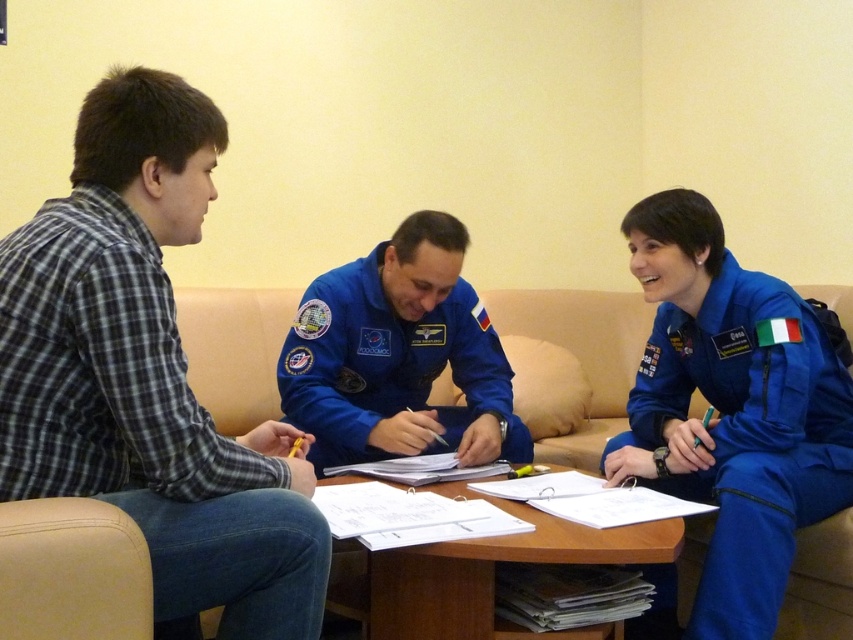
Question: Is plaid shirt at left thinner than wooden table at center?

Choices:
 (A) yes
 (B) no

Answer: (A)

Question: Does plaid shirt at left appear on the right side of wooden table at center?

Choices:
 (A) yes
 (B) no

Answer: (B)

Question: Which is farther from the wooden table at center?

Choices:
 (A) plaid shirt at left
 (B) blue fabric astronaut at center

Answer: (A)

Question: In this image, where is blue fabric astronaut at center located relative to wooden table at center?

Choices:
 (A) above
 (B) below

Answer: (A)

Question: Which point appears closest to the camera in this image?

Choices:
 (A) (445, 636)
 (B) (115, 124)
 (C) (427, 244)

Answer: (B)

Question: Which is farther from the plaid shirt at left?

Choices:
 (A) blue fabric astronaut at center
 (B) wooden table at center

Answer: (A)